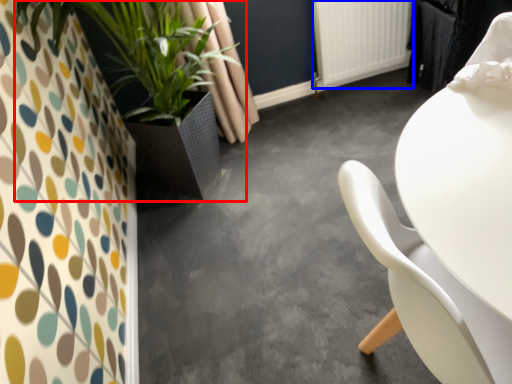
Question: Which object appears closest to the camera in this image, houseplant (highlighted by a red box) or radiator (highlighted by a blue box)?

Choices:
 (A) houseplant
 (B) radiator

Answer: (A)